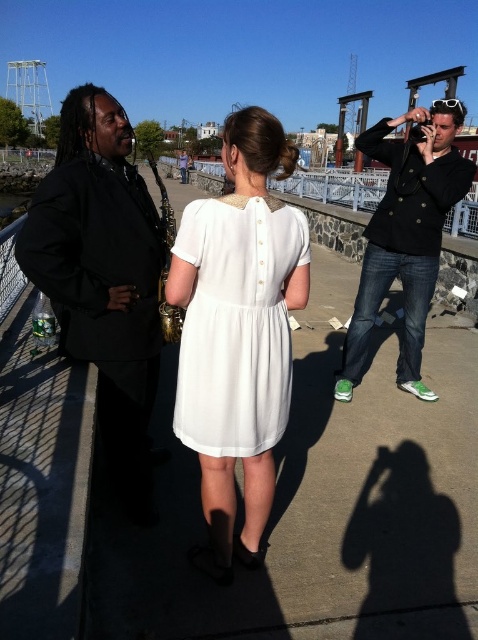
You are a fashion designer observing this scene. You need to decide which garment to recommend for a client who prefers larger, more formal attire. Which one between the black matte suit at left and the black leather jacket at right would you suggest?

The black matte suit at left is larger in size than the black leather jacket at right, so it would be the better recommendation for someone preferring larger, more formal attire.

You are a photographer trying to capture the scene. You notice the white satin dress at center and the black leather jacket at right. Which object is positioned higher in the image?

The white satin dress at center is located above the black leather jacket at right, so it is positioned higher in the image.